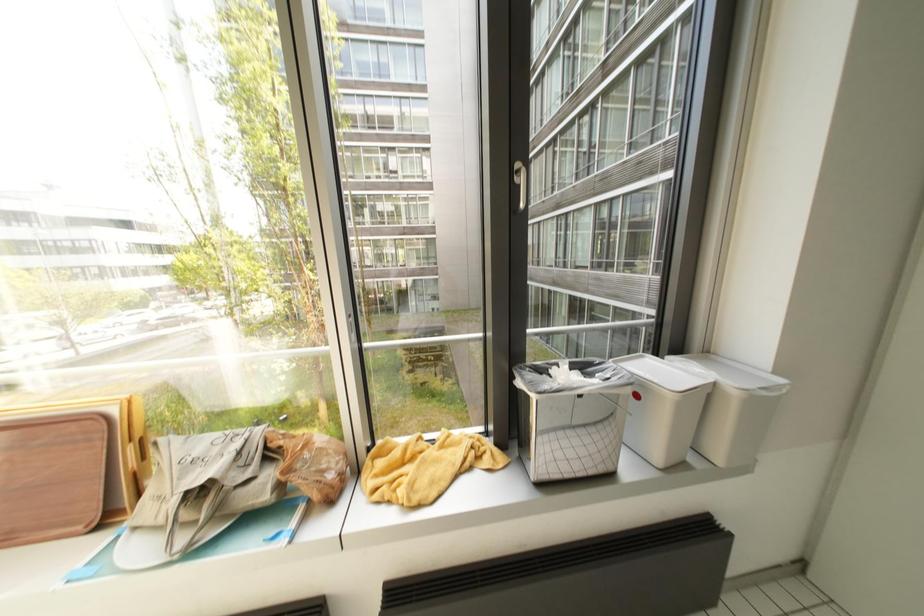
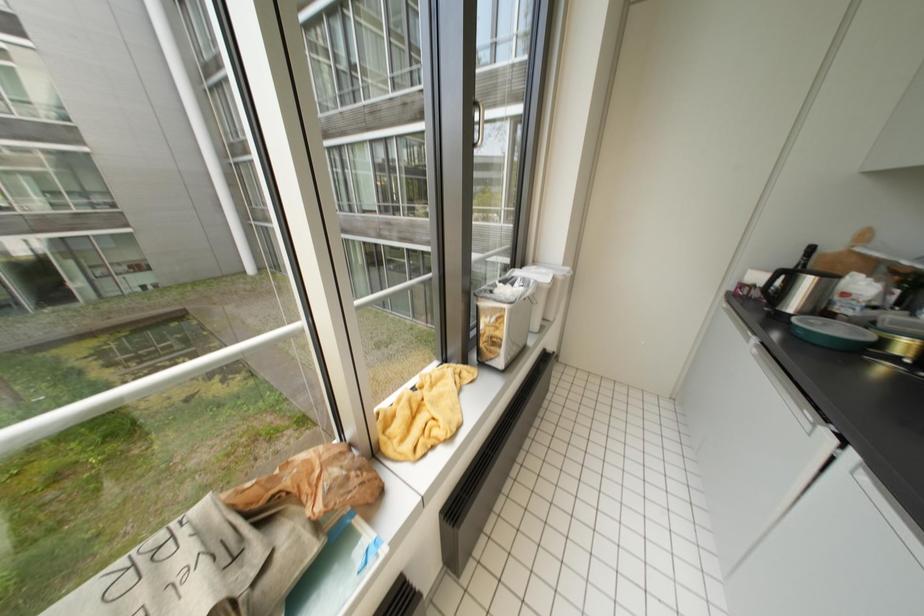
The images are taken continuously from a first-person perspective. In which direction is your viewpoint rotating?

The camera's rotation is toward right-down.